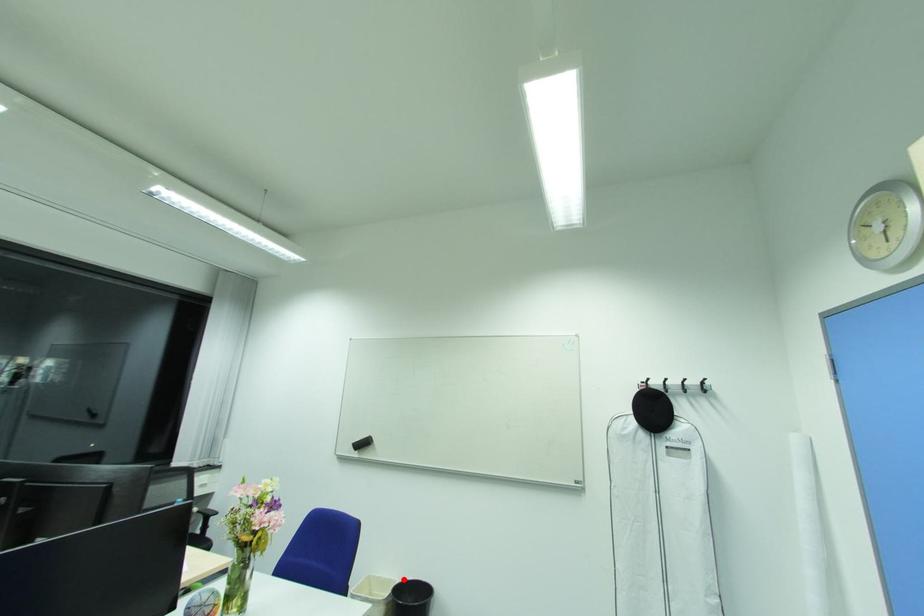
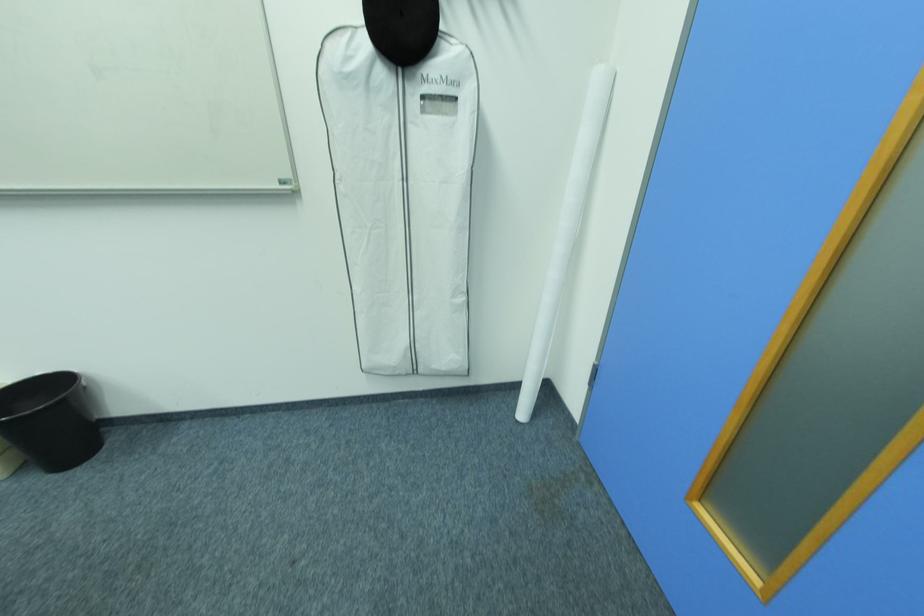
In the second image, find the point that corresponds to the highlighted location in the first image.

(17, 382)